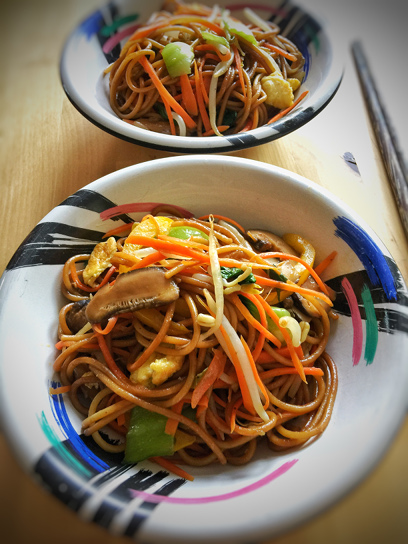
The image size is (408, 544). What are the coordinates of `abstract paint` in the screenshot? It's located at (76, 446), (143, 505), (380, 289), (105, 24).